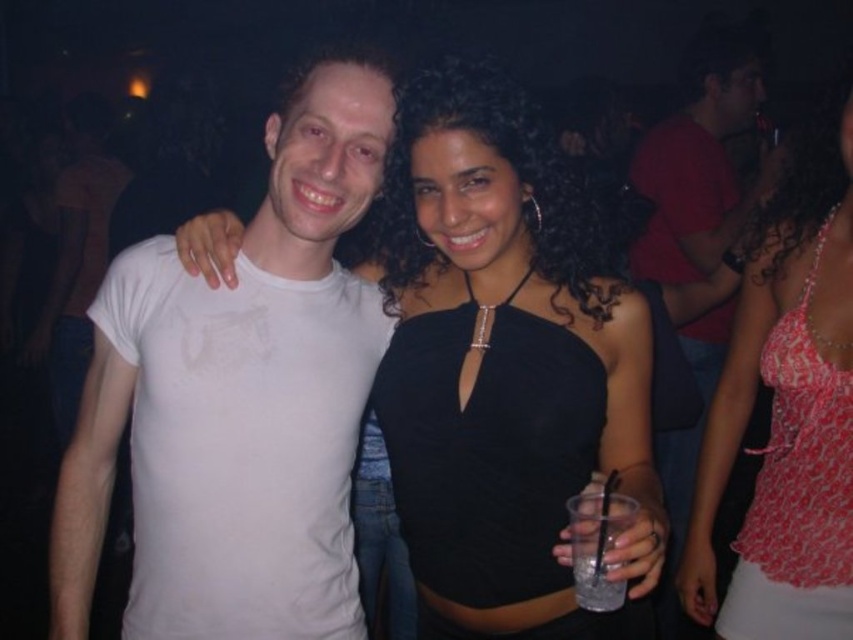
Question: Which object appears closest to the camera in this image?

Choices:
 (A) clear plastic cup at center
 (B) black satin dress at center
 (C) matte black shirt at upper right

Answer: (B)

Question: Which object is farther from the camera taking this photo?

Choices:
 (A) pink lace top at center
 (B) black satin dress at center
 (C) clear plastic cup at center

Answer: (A)

Question: Considering the real-world distances, which object is farthest from the white matte t-shirt at center?

Choices:
 (A) pink lace top at center
 (B) clear plastic cup at center

Answer: (A)

Question: Is matte black shirt at upper right thinner than clear plastic cup at center?

Choices:
 (A) no
 (B) yes

Answer: (A)

Question: Does black satin dress at center have a smaller size compared to matte black shirt at upper right?

Choices:
 (A) no
 (B) yes

Answer: (B)

Question: Does pink lace top at center appear under matte black shirt at upper right?

Choices:
 (A) no
 (B) yes

Answer: (B)